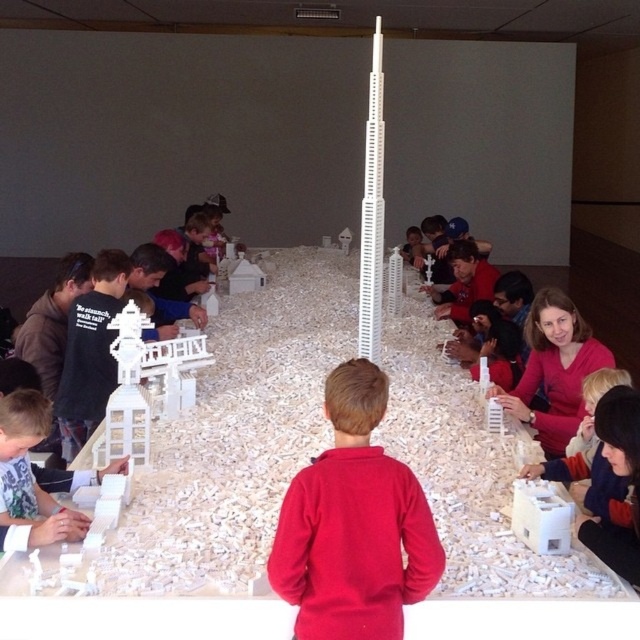
Question: Does red fleece sweater at center have a larger size compared to white matte tower at center?

Choices:
 (A) yes
 (B) no

Answer: (B)

Question: From the image, what is the correct spatial relationship of red fleece sweater at center in relation to white matte tower at center?

Choices:
 (A) right
 (B) left

Answer: (B)

Question: Which object appears closest to the camera in this image?

Choices:
 (A) red fleece sweater at center
 (B) white matte tower at center

Answer: (A)

Question: Among these points, which one is farthest from the camera?

Choices:
 (A) (547, 413)
 (B) (388, 515)

Answer: (A)

Question: Can you confirm if red fleece sweater at center is positioned to the left of white matte tower at center?

Choices:
 (A) yes
 (B) no

Answer: (A)